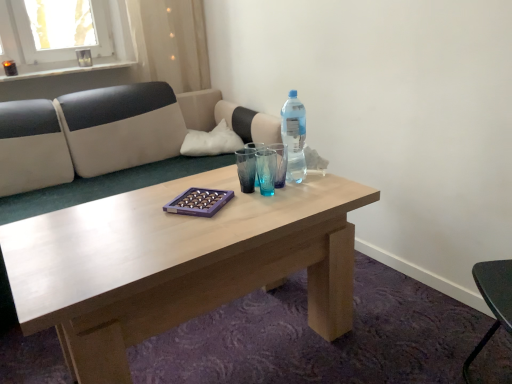
Question: Considering the positions of point (75, 54) and point (122, 233), is point (75, 54) closer or farther from the camera than point (122, 233)?

Choices:
 (A) closer
 (B) farther

Answer: (B)

Question: Is transparent glass vase at upper left spatially inside light brown wood coffee table at center, or outside of it?

Choices:
 (A) outside
 (B) inside

Answer: (A)

Question: Which of these objects is positioned farthest from the transparent plastic bottle at center?

Choices:
 (A) white fabric pillow at upper center
 (B) translucent plastic bottle at center
 (C) transparent glass vase at upper left
 (D) light brown wood coffee table at center

Answer: (C)

Question: Which is nearer to the light brown wood coffee table at center?

Choices:
 (A) white fabric pillow at upper center
 (B) translucent plastic bottle at center
 (C) transparent glass vase at upper left
 (D) transparent plastic bottle at center

Answer: (D)